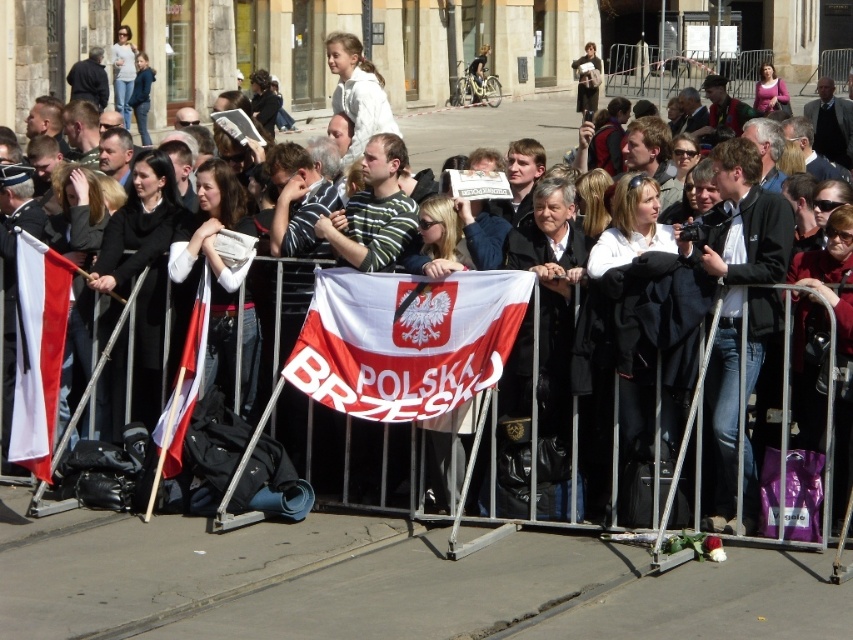
Question: Which object appears closest to the camera in this image?

Choices:
 (A) whitematerial/textureflag at center
 (B) white cotton shirt at upper center
 (C) black leather jacket at center
 (D) white fabric flag at left

Answer: (C)

Question: Is black leather jacket at center positioned behind white matte jacket at upper center?

Choices:
 (A) no
 (B) yes

Answer: (A)

Question: Can you confirm if white fabric flag at center is positioned below white cotton shirt at upper center?

Choices:
 (A) no
 (B) yes

Answer: (B)

Question: Which of the following is the farthest from the observer?

Choices:
 (A) white fabric flag at left
 (B) white fabric flag at center
 (C) black leather jacket at center
 (D) white matte jacket at upper center

Answer: (D)

Question: Can you confirm if whitematerial/textureflag at center is positioned to the left of matte black jacket at center?

Choices:
 (A) no
 (B) yes

Answer: (B)

Question: Which object appears farthest from the camera in this image?

Choices:
 (A) white cotton shirt at upper center
 (B) whitematerial/textureflag at center
 (C) white matte jacket at upper center
 (D) matte black jacket at center

Answer: (D)